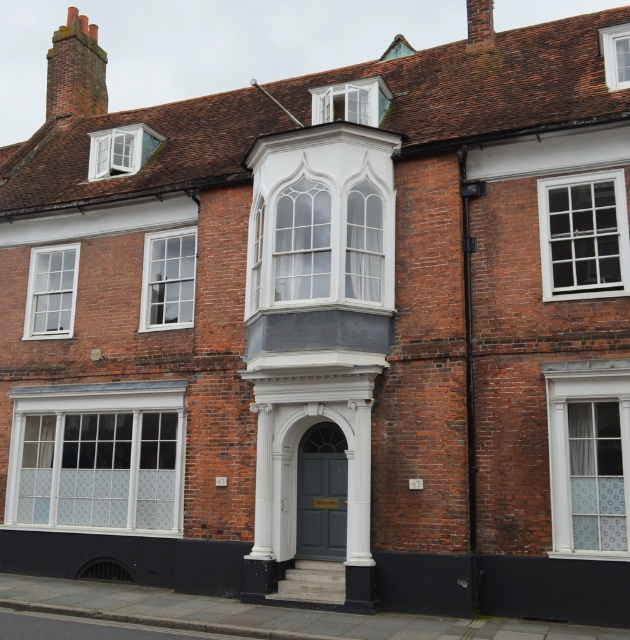
Question: Which object appears farthest from the camera in this image?

Choices:
 (A) white textured glass at center
 (B) clear glass window at center
 (C) white glass bay window at lower left

Answer: (C)

Question: Among these points, which one is nearest to the camera?

Choices:
 (A) (25, 468)
 (B) (60, 248)
 (C) (607, 195)

Answer: (C)

Question: Considering the relative positions of white textured glass at center and matte white bay window at upper center in the image provided, where is white textured glass at center located with respect to matte white bay window at upper center?

Choices:
 (A) below
 (B) above

Answer: (A)

Question: Is satin glass window at center to the left of white textured glass at center from the viewer's perspective?

Choices:
 (A) no
 (B) yes

Answer: (B)

Question: Which object is the farthest from the white glass bay window at lower left?

Choices:
 (A) satin glass window at center
 (B) clear glass bay window at upper center
 (C) white textured glass at center
 (D) matte white bay window at upper center

Answer: (B)

Question: Is white glass bay window at center bigger than clear glass window at center?

Choices:
 (A) no
 (B) yes

Answer: (B)